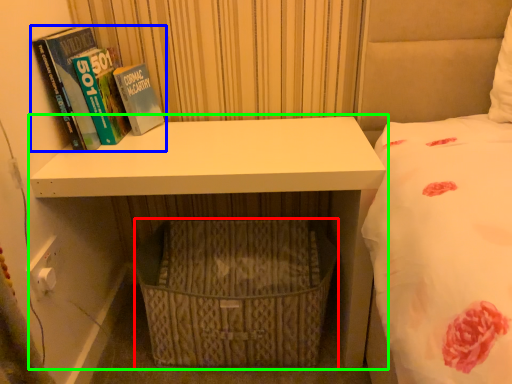
Question: Which is nearer to the basket (highlighted by a red box)? book (highlighted by a blue box) or shelf (highlighted by a green box).

Choices:
 (A) book
 (B) shelf

Answer: (B)